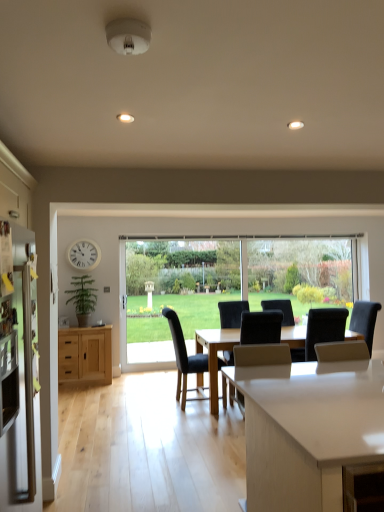
Question: Considering the relative sizes of green matte plant at left and white plastic clock at upper left in the image provided, is green matte plant at left thinner than white plastic clock at upper left?

Choices:
 (A) no
 (B) yes

Answer: (A)

Question: Does green matte plant at left come behind white plastic clock at upper left?

Choices:
 (A) no
 (B) yes

Answer: (A)

Question: Is the depth of green matte plant at left less than that of white plastic clock at upper left?

Choices:
 (A) yes
 (B) no

Answer: (A)

Question: From the image's perspective, is green matte plant at left located beneath white plastic clock at upper left?

Choices:
 (A) no
 (B) yes

Answer: (B)

Question: Is green matte plant at left directly adjacent to white plastic clock at upper left?

Choices:
 (A) no
 (B) yes

Answer: (A)

Question: Is green matte plant at left wider than white plastic clock at upper left?

Choices:
 (A) yes
 (B) no

Answer: (A)

Question: Considering the relative positions of black fabric chair at center, which ranks as the third chair in left-to-right order, and dark blue fabric chair at center, the 2th chair from the left, in the image provided, is black fabric chair at center, which ranks as the third chair in left-to-right order, to the left of dark blue fabric chair at center, the 2th chair from the left, from the viewer's perspective?

Choices:
 (A) no
 (B) yes

Answer: (A)

Question: Does black fabric chair at center, which ranks as the third chair in left-to-right order, come in front of dark blue fabric chair at center, acting as the 2th chair starting from the right?

Choices:
 (A) yes
 (B) no

Answer: (B)

Question: Is there a large distance between black fabric chair at center, which ranks as the third chair in left-to-right order, and dark blue fabric chair at center, the 2th chair from the left?

Choices:
 (A) no
 (B) yes

Answer: (B)

Question: Does black fabric chair at center, placed as the first chair when sorted from right to left, lie behind dark blue fabric chair at center, acting as the 2th chair starting from the right?

Choices:
 (A) no
 (B) yes

Answer: (B)

Question: Is black fabric chair at center, placed as the first chair when sorted from right to left, touching dark blue fabric chair at center, the 2th chair from the left?

Choices:
 (A) no
 (B) yes

Answer: (A)

Question: Is black fabric chair at center, placed as the first chair when sorted from right to left, facing towards dark blue fabric chair at center, acting as the 2th chair starting from the right?

Choices:
 (A) yes
 (B) no

Answer: (B)

Question: Can you confirm if black leather chair at center, placed as the 1th chair when sorted from left to right, is thinner than black fabric chair at center, placed as the first chair when sorted from right to left?

Choices:
 (A) yes
 (B) no

Answer: (A)